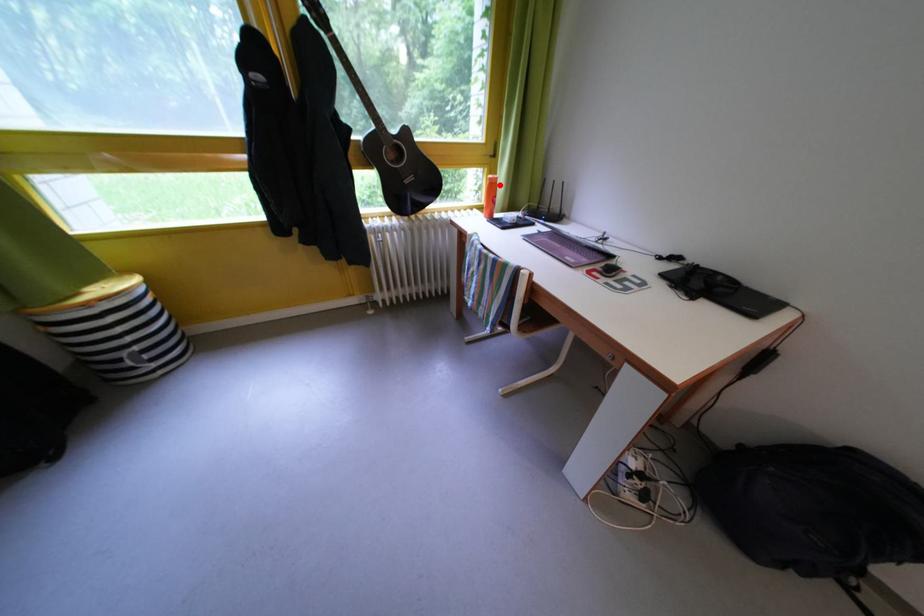
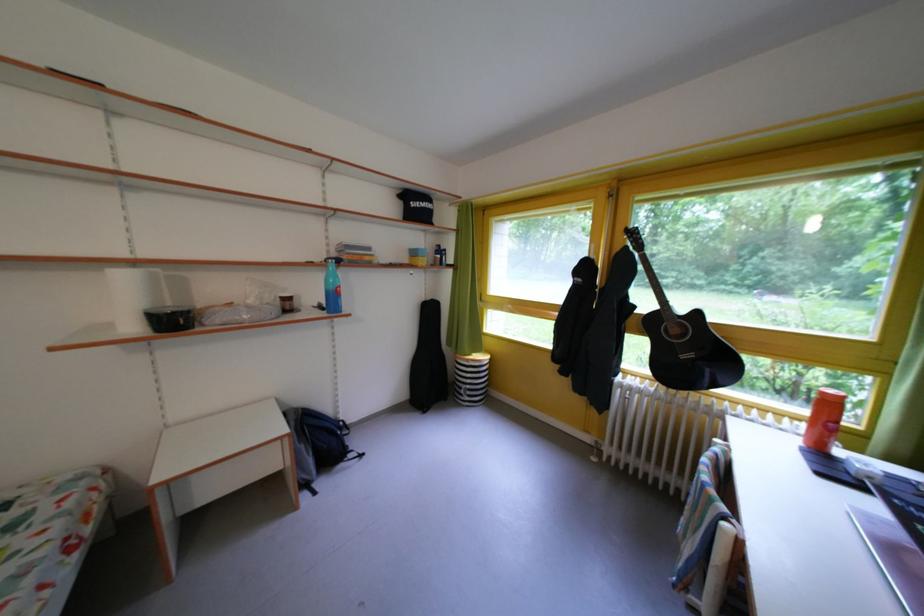
Question: A red point is marked in image1. In image2, is the corresponding 3D point closer to the camera or farther? Reply with the corresponding letter.

Choices:
 (A) The corresponding 3D point is closer.
 (B) The corresponding 3D point is farther.

Answer: (B)